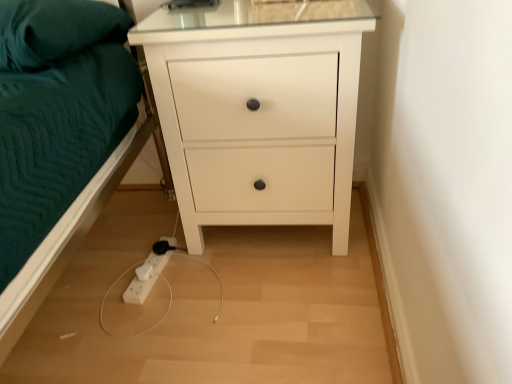
Question: Is point (347, 1) closer or farther from the camera than point (9, 19)?

Choices:
 (A) closer
 (B) farther

Answer: (B)

Question: Considering their positions, is white matte chest of drawers at center located in front of or behind teal fabric pillow at upper left?

Choices:
 (A) front
 (B) behind

Answer: (B)

Question: Based on their sizes in the image, would you say white matte chest of drawers at center is bigger or smaller than teal fabric pillow at upper left?

Choices:
 (A) small
 (B) big

Answer: (B)

Question: From a real-world perspective, is teal fabric pillow at upper left positioned above or below white matte chest of drawers at center?

Choices:
 (A) below
 (B) above

Answer: (B)

Question: Considering the relative positions of teal fabric pillow at upper left and white matte chest of drawers at center in the image provided, is teal fabric pillow at upper left to the left or to the right of white matte chest of drawers at center?

Choices:
 (A) left
 (B) right

Answer: (A)

Question: Is teal fabric pillow at upper left situated inside white matte chest of drawers at center or outside?

Choices:
 (A) inside
 (B) outside

Answer: (B)

Question: Does point (115, 11) appear closer or farther from the camera than point (263, 104)?

Choices:
 (A) closer
 (B) farther

Answer: (B)